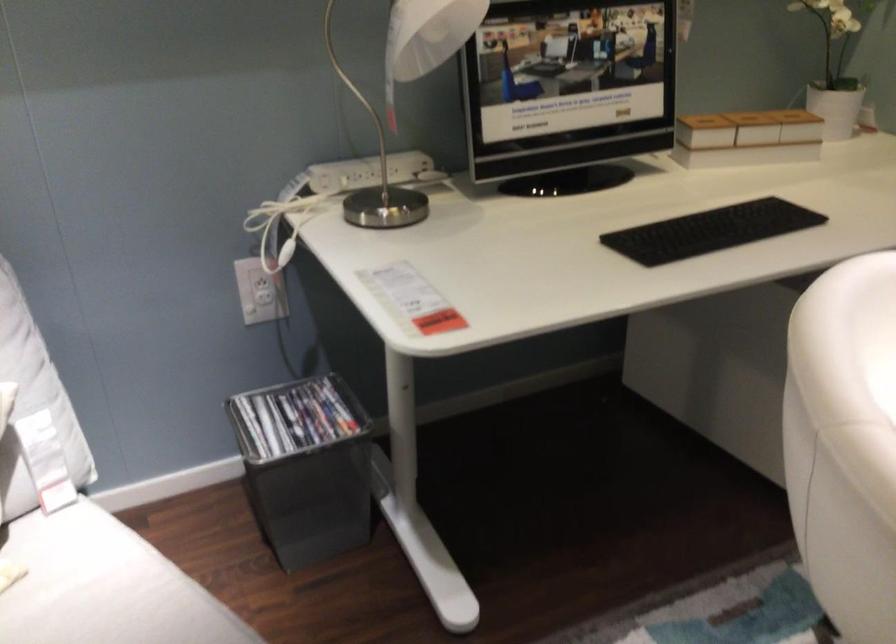
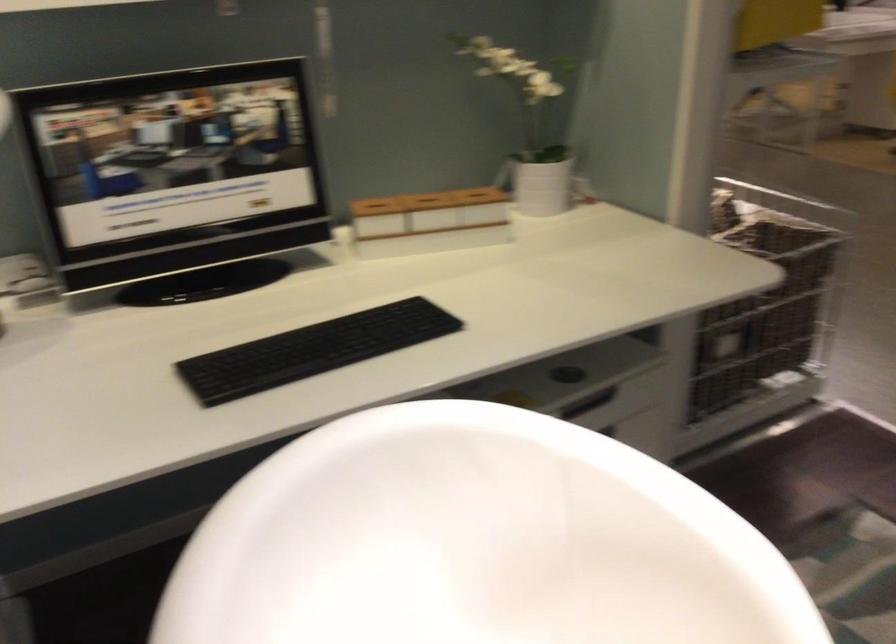
Which direction would the cameraman need to move to produce the second image?

The cameraman walked toward right, forward.